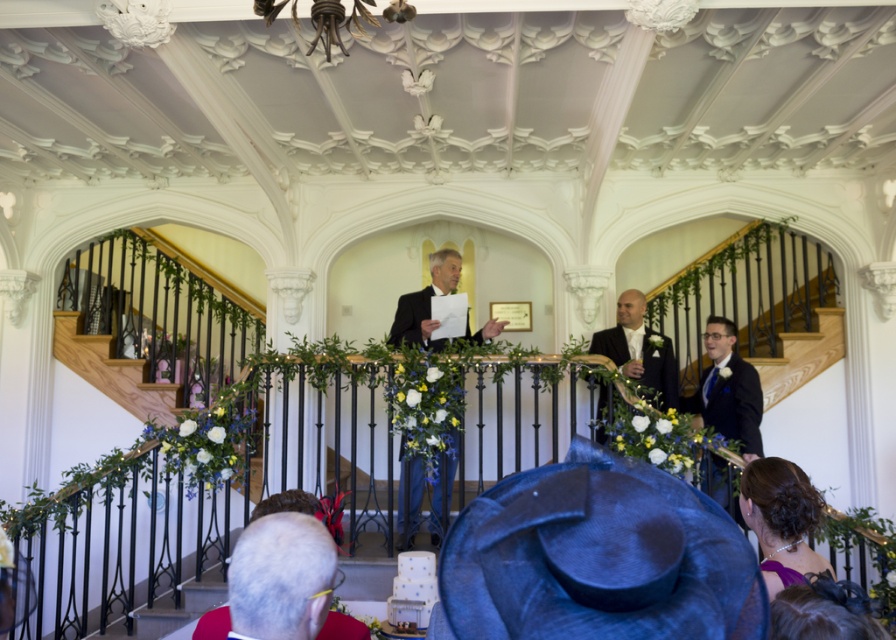
You are standing at the event and want to reach the point marked as point [778,509]. Considering the space between you and that point, is there enough room to walk comfortably? Please provide your answer based on the distance provided.

The distance between you and point [778,509] is 7.88 feet. Since this distance is more than enough for comfortable walking, there is sufficient space to move freely towards that point.

You are a photographer at the event and need to capture a photo of both the purple satin dress at lower right and the dark blue suit at center. Given their sizes, which one should you focus on first to ensure both are clearly visible in the frame?

The purple satin dress at lower right is smaller than the dark blue suit at center, so you should focus on the dark blue suit at center first to ensure it is clearly visible, then adjust the framing to include the smaller purple satin dress at lower right.